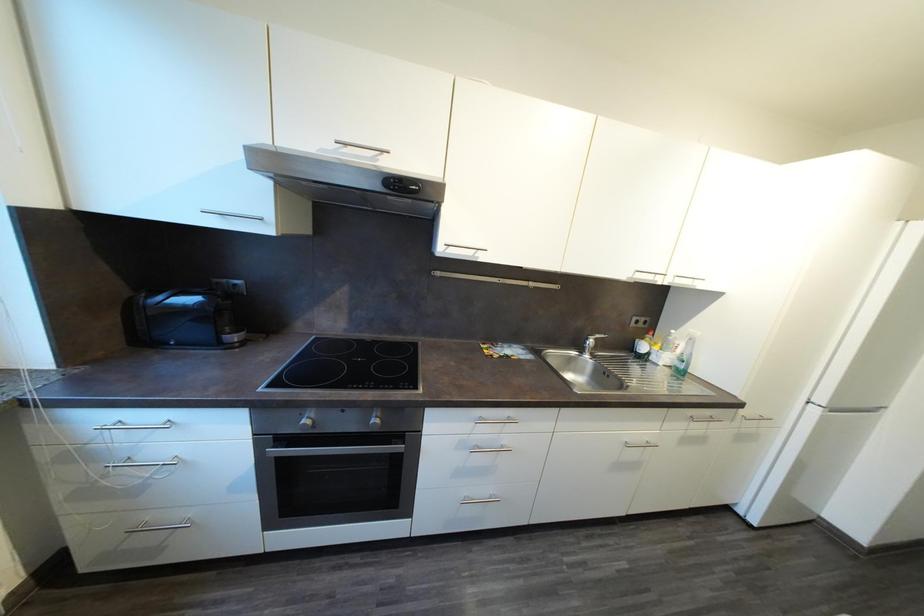
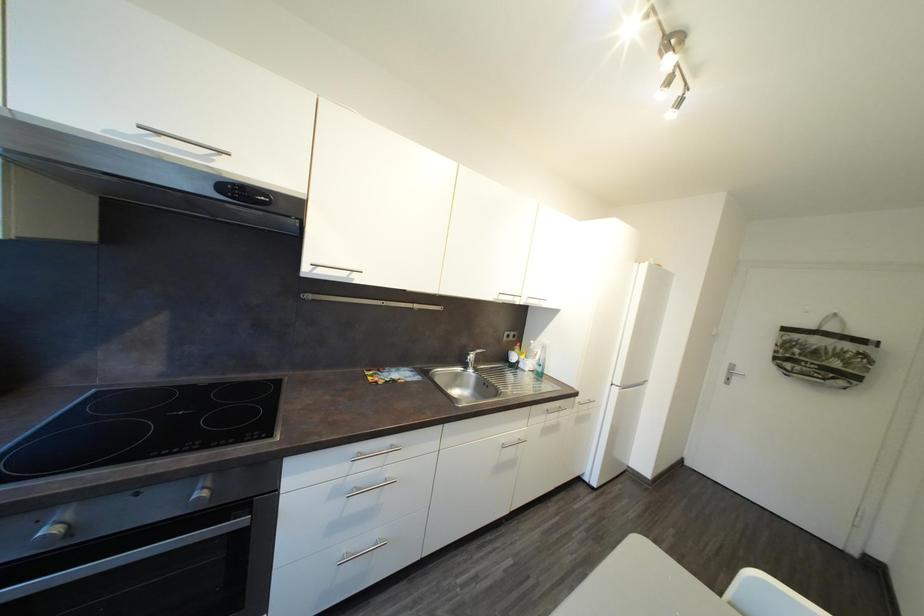
Question: The camera is either moving clockwise (left) or counter-clockwise (right) around the object. The first image is from the beginning of the video and the second image is from the end. Is the camera moving left or right when shooting the video?

Choices:
 (A) Left
 (B) Right

Answer: (A)